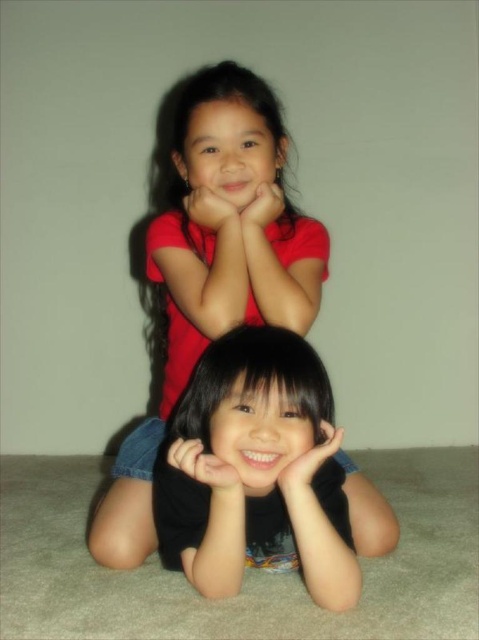
Can you confirm if matte red shirt at upper center is bigger than black matte hand at lower center?

Yes.

Is point (185, 168) behind point (286, 480)?

Yes.

You are a GUI agent. You are given a task and a screenshot of the screen. Output one action in this format:
    pyautogui.click(x=<x>, y=<y>)
    Task: Click on the matte red shirt at upper center
    
    Given the screenshot: What is the action you would take?
    pyautogui.click(x=212, y=273)

Is black matte hair at lower center positioned before smooth skin hand at lower center?

Yes, it is in front of smooth skin hand at lower center.

Measure the distance from black matte hair at lower center to smooth skin hand at lower center.

5.53 inches

Describe the element at coordinates (255, 468) in the screenshot. I see `black matte hair at lower center` at that location.

Where is `black matte hair at lower center`? The width and height of the screenshot is (479, 640). black matte hair at lower center is located at coordinates (255, 468).

Who is more forward, [192,348] or [277,195]?

Point [277,195] is more forward.

Where is `matte red shirt at upper center`? This screenshot has width=479, height=640. matte red shirt at upper center is located at coordinates (212, 273).